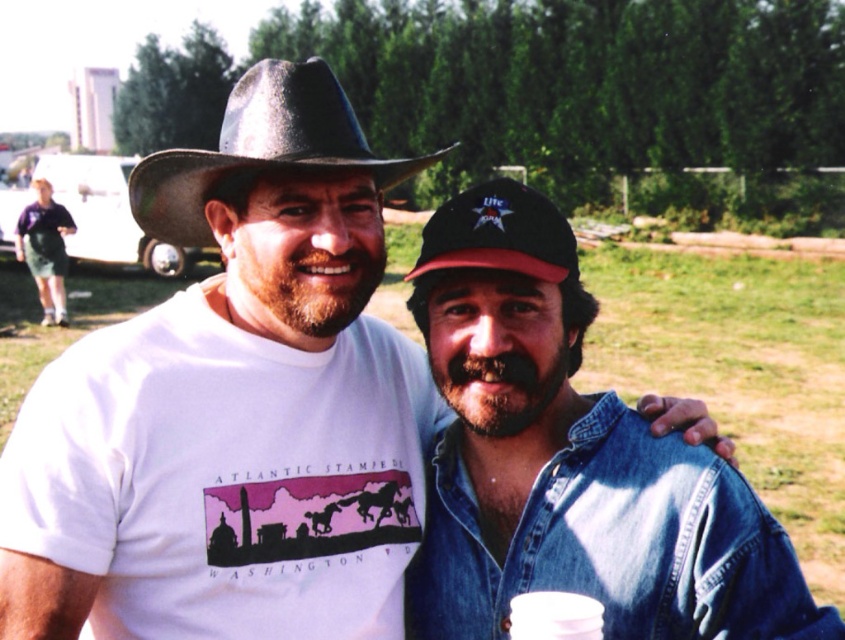
You are a photographer trying to capture a closeup of the white plastic cup at lower center without the dark gray felt cowboy hat at upper left appearing in the frame. Is it possible to do so by adjusting your camera angle downward?

Yes, since the dark gray felt cowboy hat at upper left is above the white plastic cup at lower center, tilting the camera downward would allow you to exclude the hat from the frame while focusing on the cup.

You are a photographer trying to capture a candid shot of the two people in the scene. You want to ensure the denim jacket at center is in the frame. Where should you position the camera relative to the two people?

The denim jacket at center is located at point (570, 460), so position the camera so that the jacket is centered within the frame to ensure it is captured clearly.

You are taking a photo of two people standing in a field. You notice two points marked at coordinates point (593, 422) and point (543, 627). Which point is closer to the camera?

Point (543, 627) is closer to the camera because it is less further than point (593, 422).